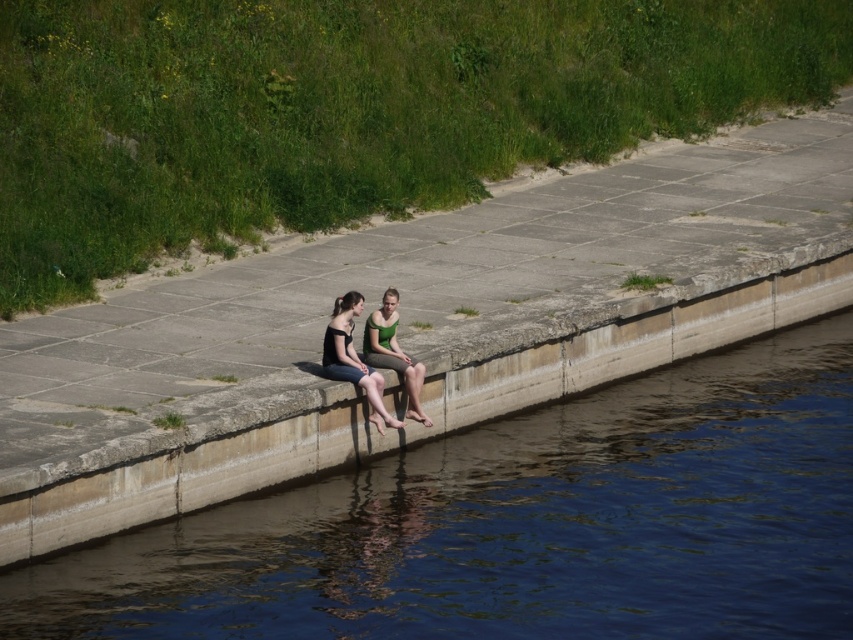
Does matte black tank top at center come in front of green matte dress at center?

Yes, it is in front of green matte dress at center.

Can you confirm if matte black tank top at center is shorter than green matte dress at center?

Yes, matte black tank top at center is shorter than green matte dress at center.

Which is in front, point (354, 292) or point (370, 353)?

Positioned in front is point (354, 292).

Identify the location of matte black tank top at center. (352, 358).

Is blue smooth water at lower center shorter than matte black tank top at center?

No.

Image resolution: width=853 pixels, height=640 pixels. I want to click on blue smooth water at lower center, so click(521, 524).

Which is in front, point (837, 611) or point (374, 326)?

Point (837, 611) is more forward.

This screenshot has height=640, width=853. In order to click on blue smooth water at lower center in this screenshot , I will do `click(521, 524)`.